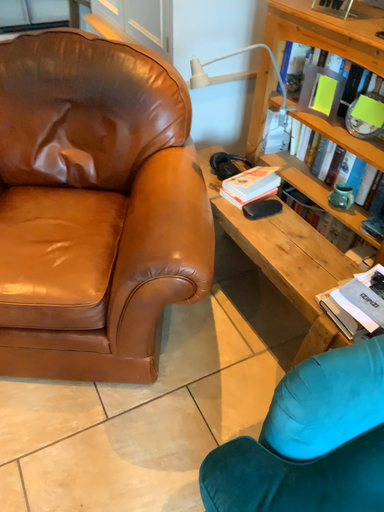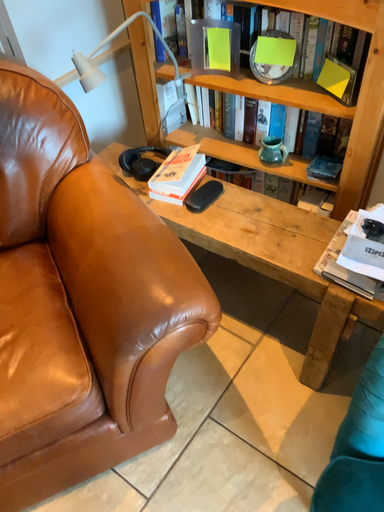
Question: How did the camera likely rotate when shooting the video?

Choices:
 (A) rotated right
 (B) rotated left

Answer: (A)